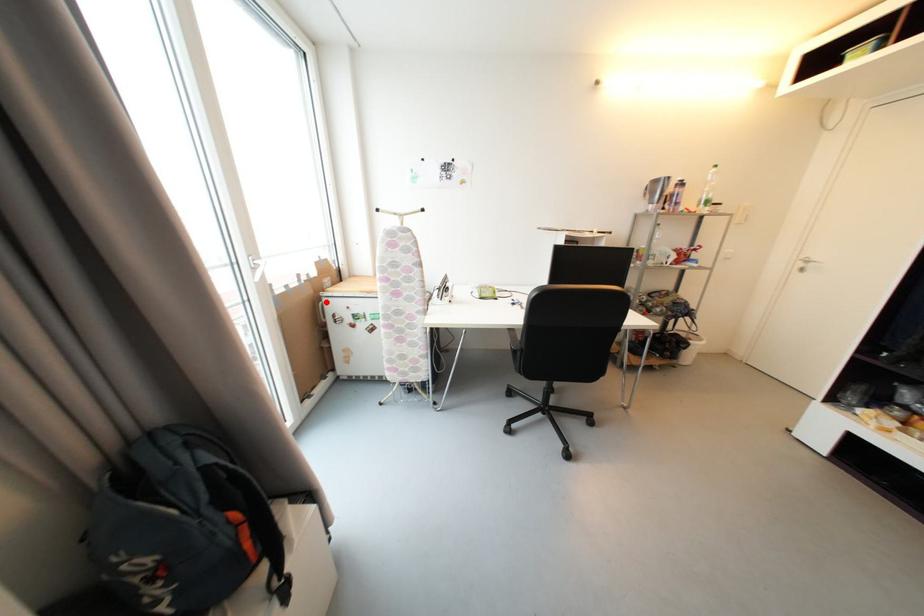
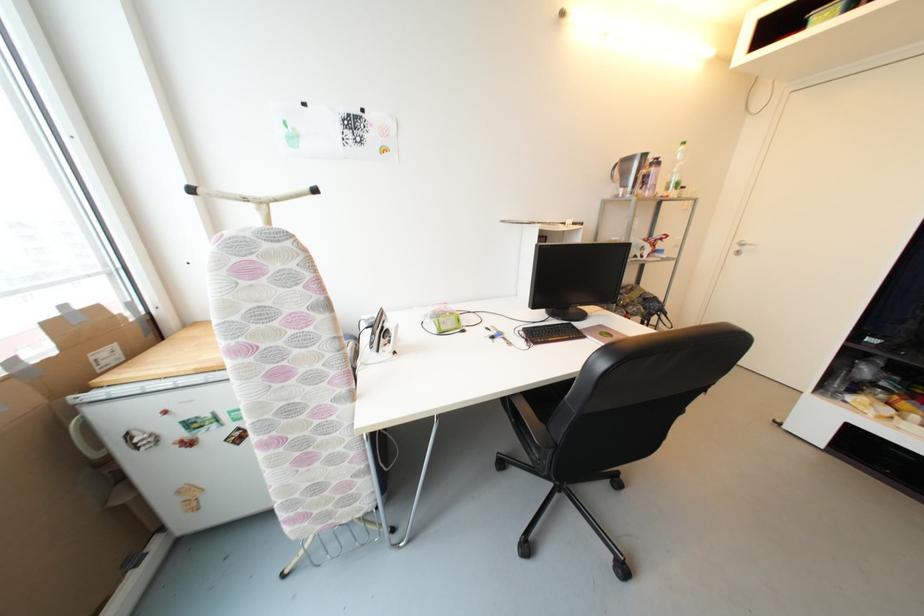
Find the pixel in the second image that matches the highlighted location in the first image.

(81, 416)